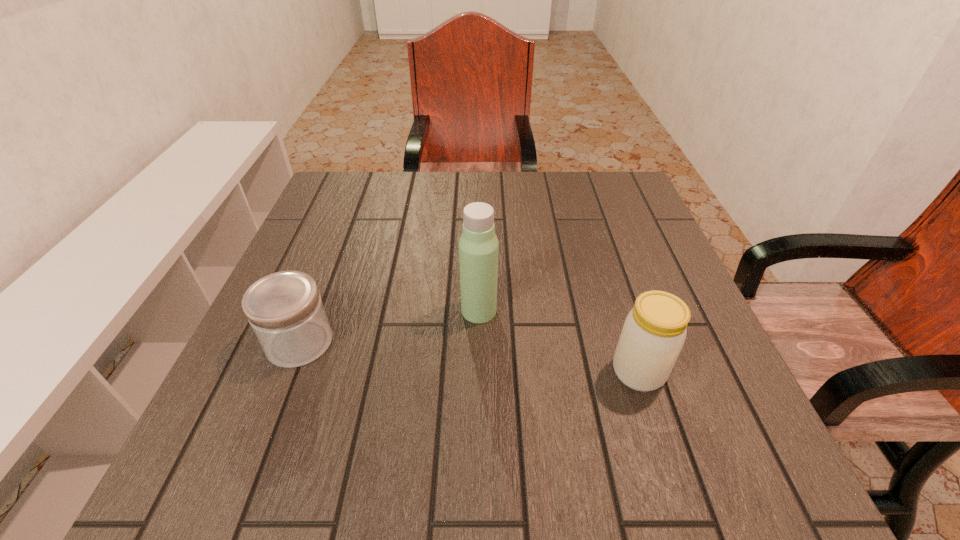
Identify the location of free space between the leftmost object and the taller jar. This screenshot has height=540, width=960. (469, 357).

The width and height of the screenshot is (960, 540). What are the coordinates of `free space between the leftmost object and the second shortest object` in the screenshot? It's located at point(469,357).

At what (x,y) coordinates should I click in order to perform the action: click on free space between the second object from left to right and the taller jar. Please return your answer as a coordinate pair (x, y). Image resolution: width=960 pixels, height=540 pixels. Looking at the image, I should click on (559, 341).

Identify the location of empty location between the second tallest object and the leftmost object. This screenshot has height=540, width=960. (469, 357).

Identify the location of vacant point located between the left jar and the thermos bottle. (389, 327).

Where is `vacant space that's between the left jar and the second tallest object`? The width and height of the screenshot is (960, 540). vacant space that's between the left jar and the second tallest object is located at coordinates (469, 357).

Identify the location of empty location between the thermos bottle and the shortest object. (389, 327).

Locate which object ranks second in proximity to the taller jar. Please provide its 2D coordinates. Your answer should be formatted as a tuple, i.e. [(x, y)], where the tuple contains the x and y coordinates of a point satisfying the conditions above.

[(285, 311)]

Locate which object is the closest to the thermos bottle. Please provide its 2D coordinates. Your answer should be formatted as a tuple, i.e. [(x, y)], where the tuple contains the x and y coordinates of a point satisfying the conditions above.

[(654, 332)]